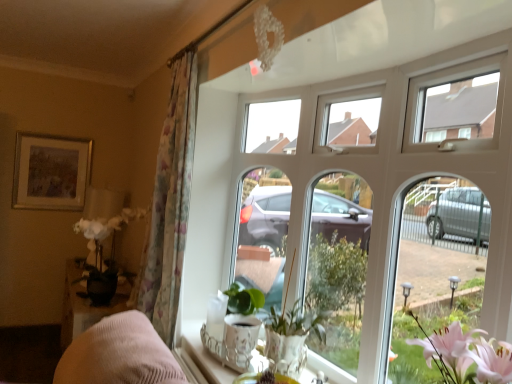
Question: Is floral fabric curtain at left taller or shorter than translucent glass vase at lower center?

Choices:
 (A) short
 (B) tall

Answer: (B)

Question: Considering the positions of floral fabric curtain at left and translucent glass vase at lower center in the image, is floral fabric curtain at left wider or thinner than translucent glass vase at lower center?

Choices:
 (A) wide
 (B) thin

Answer: (A)

Question: Estimate the real-world distances between objects in this image. Which object is farther from the gold-framed painting at upper left?

Choices:
 (A) floral fabric curtain at left
 (B) white ceramic tray at lower center
 (C) translucent glass vase at lower center
 (D) white glass window at center
 (E) green matte plant at center

Answer: (E)

Question: Which is farther from the translucent glass vase at lower center?

Choices:
 (A) floral fabric curtain at left
 (B) gold-framed painting at upper left
 (C) white glass window at center
 (D) white ceramic tray at lower center
 (E) green matte plant at center

Answer: (B)